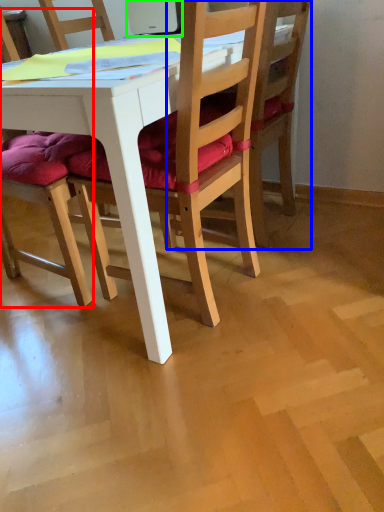
Question: Which object is positioned farthest from chair (highlighted by a red box)? Select from chair (highlighted by a blue box) and laptop (highlighted by a green box).

Choices:
 (A) chair
 (B) laptop

Answer: (B)